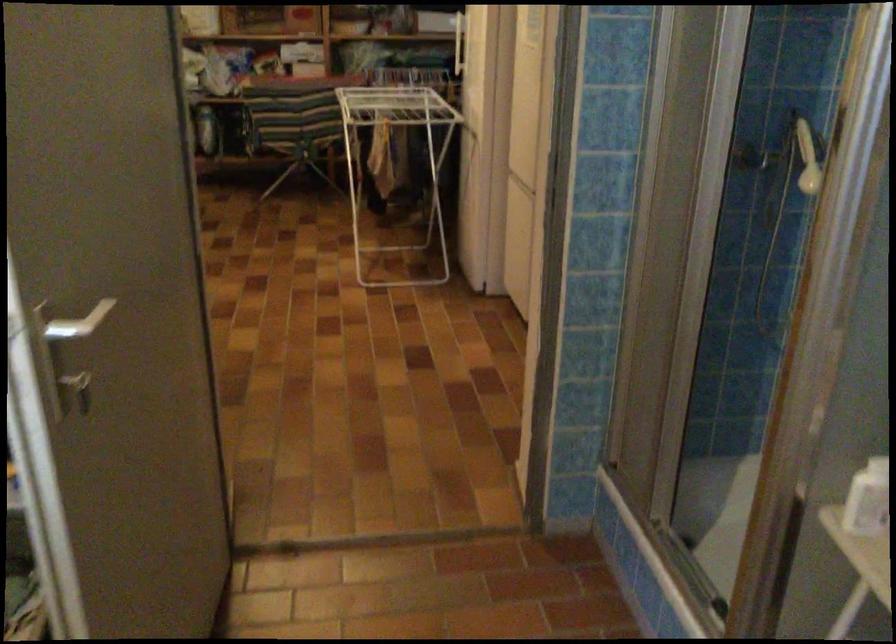
Describe the element at coordinates (306, 128) in the screenshot. I see `the chair sitting surface` at that location.